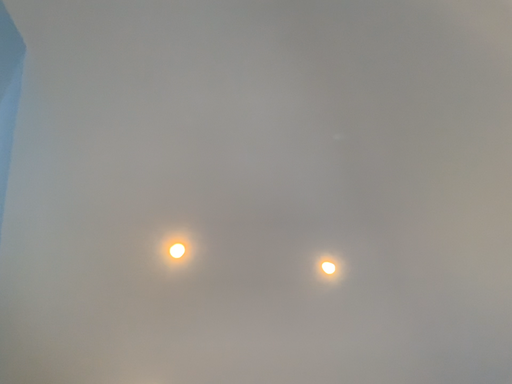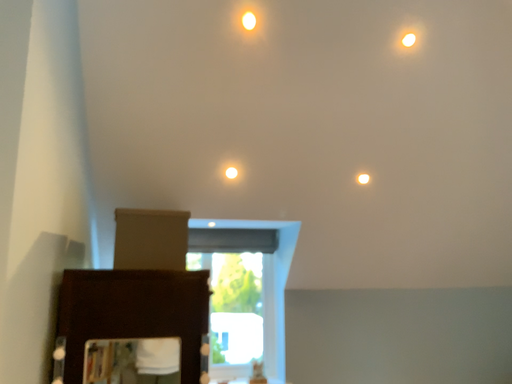
Question: Which way did the camera rotate in the video?

Choices:
 (A) rotated downward
 (B) rotated upward

Answer: (A)